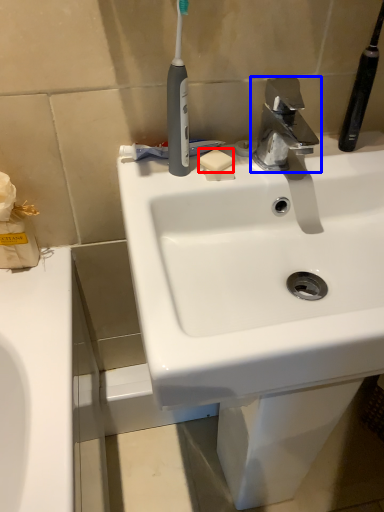
Question: Which object is closer to the camera taking this photo, soap (highlighted by a red box) or tap (highlighted by a blue box)?

Choices:
 (A) soap
 (B) tap

Answer: (B)